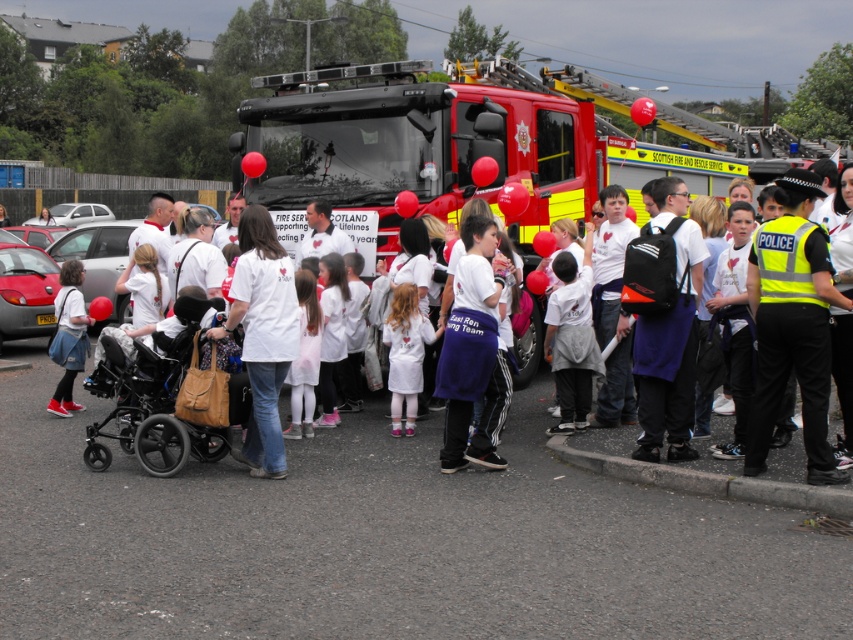
Can you confirm if black fabric baby carriage at center-left is positioned above white cotton t-shirt at center?

Actually, black fabric baby carriage at center-left is below white cotton t-shirt at center.

Which is more to the left, black fabric baby carriage at center-left or white cotton t-shirt at center?

Positioned to the left is black fabric baby carriage at center-left.

Is point (196, 298) closer to camera compared to point (463, 278)?

No, it is behind (463, 278).

You are a GUI agent. You are given a task and a screenshot of the screen. Output one action in this format:
    pyautogui.click(x=<x>, y=<y>)
    Task: Click on the black fabric baby carriage at center-left
    This screenshot has height=640, width=853.
    Given the screenshot: What is the action you would take?
    pyautogui.click(x=161, y=400)

Does black fabric baby carriage at center-left appear under white cotton dress at center?

Yes.

Which of these two, black fabric baby carriage at center-left or white cotton dress at center, stands taller?

white cotton dress at center is taller.

Locate an element on the screen. black fabric baby carriage at center-left is located at coordinates (161, 400).

Who is positioned more to the right, red/yellow fire truck at center or black fabric baby carriage at center-left?

red/yellow fire truck at center

Is red/yellow fire truck at center smaller than black fabric baby carriage at center-left?

No, red/yellow fire truck at center is not smaller than black fabric baby carriage at center-left.

Between point (524, 184) and point (158, 340), which one is positioned in front?

Point (158, 340)

Locate an element on the screen. The width and height of the screenshot is (853, 640). red/yellow fire truck at center is located at coordinates (439, 144).